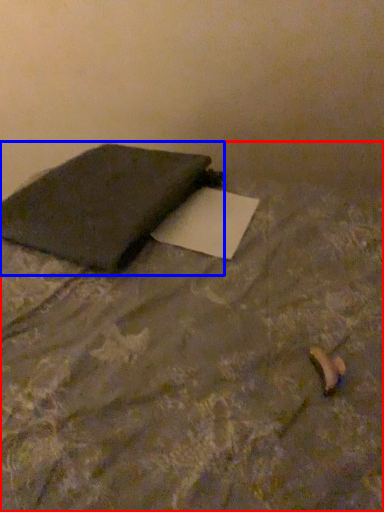
Question: Which object is closer to the camera taking this photo, furniture (highlighted by a red box) or notebook (highlighted by a blue box)?

Choices:
 (A) furniture
 (B) notebook

Answer: (A)